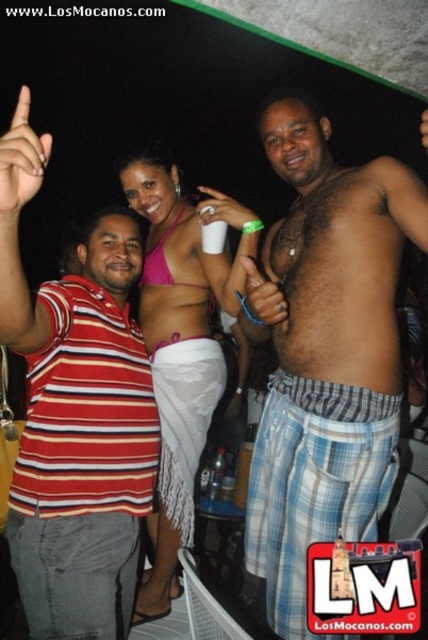
Question: Considering the relative positions of shiny plaid shorts at center and striped cotton shirt at left in the image provided, where is shiny plaid shorts at center located with respect to striped cotton shirt at left?

Choices:
 (A) left
 (B) right

Answer: (B)

Question: Can you confirm if shiny plaid shorts at center is positioned to the left of hairy skin at center?

Choices:
 (A) no
 (B) yes

Answer: (B)

Question: Which point appears farthest from the camera in this image?

Choices:
 (A) (121, 314)
 (B) (309, 212)
 (C) (315, 381)
 (D) (160, 198)

Answer: (D)

Question: Among these objects, which one is farthest from the camera?

Choices:
 (A) hairy skin at center
 (B) striped cotton shirt at left
 (C) shiny plaid shorts at center

Answer: (A)

Question: Can you confirm if striped cotton shirt at left is wider than hairy skin at center?

Choices:
 (A) yes
 (B) no

Answer: (A)

Question: Based on their relative distances, which object is farther from the shiny plaid shorts at center?

Choices:
 (A) smooth skin torso at center
 (B) striped cotton shirt at left
 (C) hairy skin at center

Answer: (B)